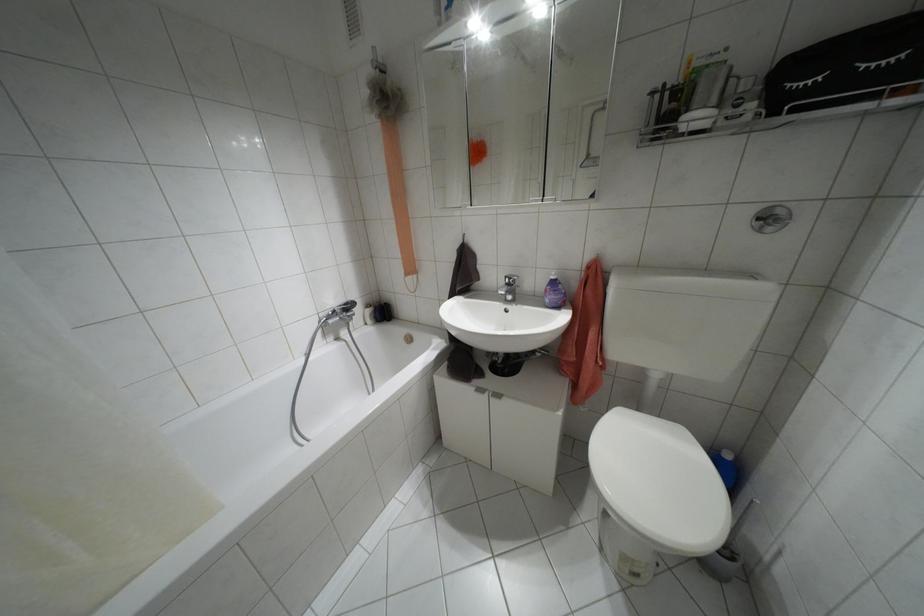
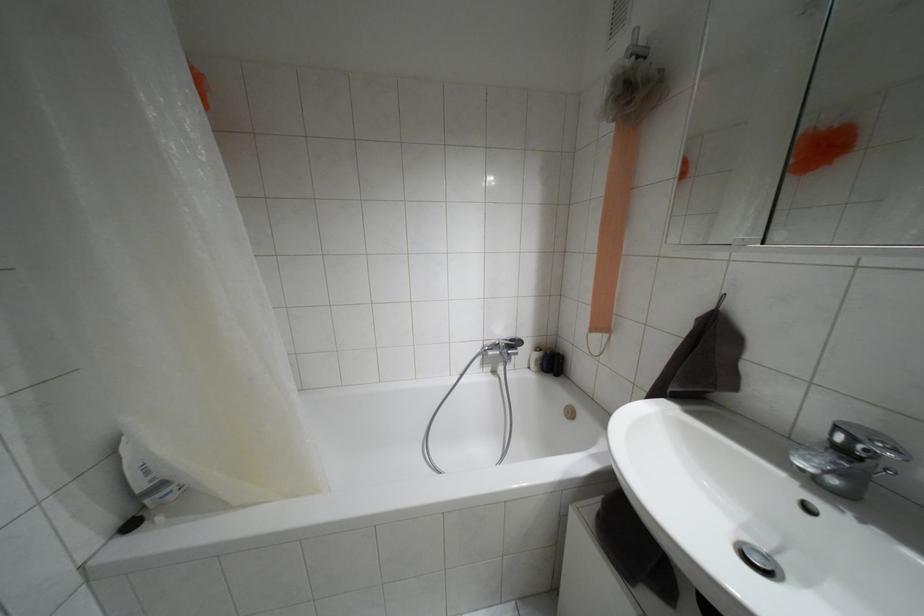
Question: The camera is either moving clockwise (left) or counter-clockwise (right) around the object. The first image is from the beginning of the video and the second image is from the end. Is the camera moving left or right when shooting the video?

Choices:
 (A) Left
 (B) Right

Answer: (B)